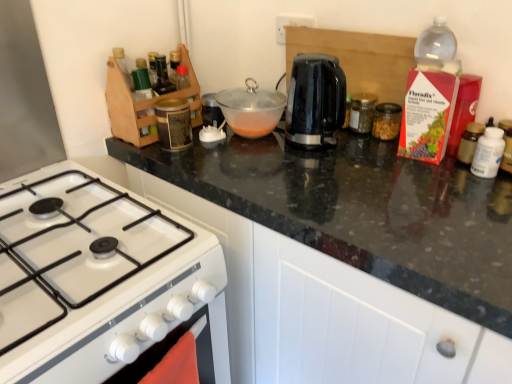
Locate an element on the screen. This screenshot has height=384, width=512. vacant space to the right of black glossy electric kettle at center, the fourth kitchen appliance viewed from the right is located at coordinates (373, 148).